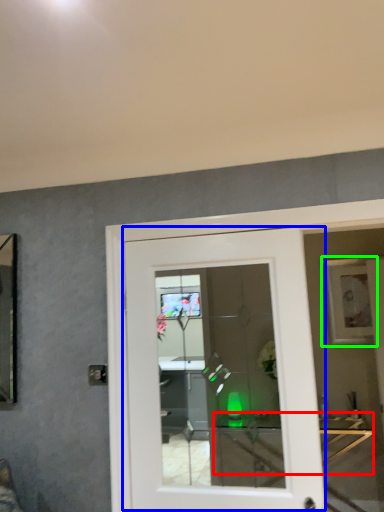
Question: Based on their relative distances, which object is farther from table (highlighted by a red box)? Choose from door (highlighted by a blue box) and picture frame (highlighted by a green box).

Choices:
 (A) door
 (B) picture frame

Answer: (A)